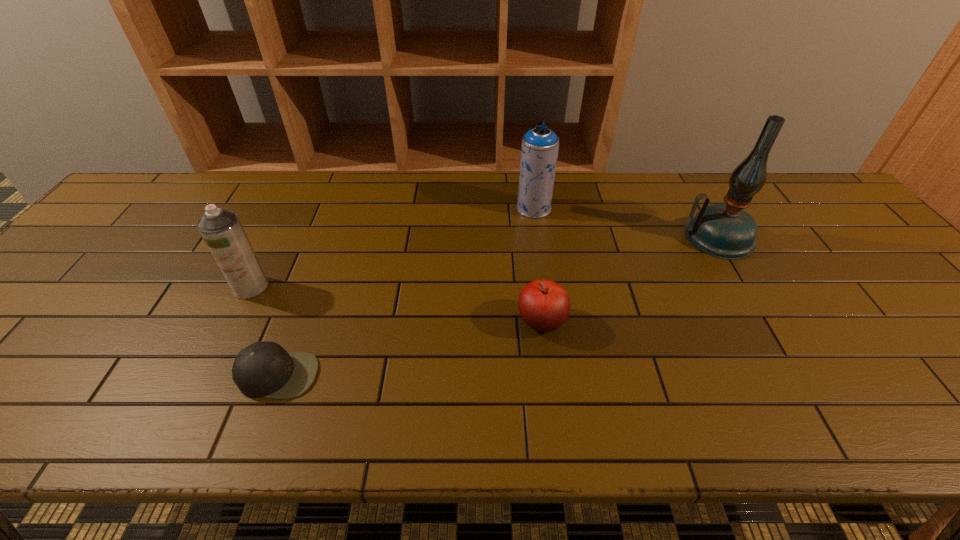
You are a GUI agent. You are given a task and a screenshot of the screen. Output one action in this format:
    pyautogui.click(x=<x>, y=<y>)
    Task: Click on the free point at the right edge
    
    Given the screenshot: What is the action you would take?
    pyautogui.click(x=851, y=278)

Find the location of a particular element. The height and width of the screenshot is (540, 960). vacant space at the far left corner is located at coordinates (161, 184).

I want to click on vacant space at the far right corner of the desktop, so click(x=822, y=192).

Where is `vacant area that lies between the oil lamp and the right aerosol can`? This screenshot has height=540, width=960. vacant area that lies between the oil lamp and the right aerosol can is located at coordinates (626, 223).

Locate an element on the screen. free area in between the second nearest object and the shortest object is located at coordinates (410, 348).

You are a GUI agent. You are given a task and a screenshot of the screen. Output one action in this format:
    pyautogui.click(x=<x>, y=<y>)
    Task: Click on the unoccupied area between the tallest object and the right aerosol can
    
    Given the screenshot: What is the action you would take?
    pyautogui.click(x=626, y=223)

Locate an element on the screen. This screenshot has width=960, height=540. empty space that is in between the farther aerosol can and the third farthest object is located at coordinates (393, 247).

This screenshot has height=540, width=960. What are the coordinates of `free spot between the apple and the oil lamp` in the screenshot? It's located at (629, 280).

Where is `vacant point located between the third nearest object and the fourth tallest object`? This screenshot has width=960, height=540. vacant point located between the third nearest object and the fourth tallest object is located at coordinates (396, 305).

You are a GUI agent. You are given a task and a screenshot of the screen. Output one action in this format:
    pyautogui.click(x=<x>, y=<y>)
    Task: Click on the vacant region between the fourth object from right to left and the nearer aerosol can
    Image resolution: width=960 pixels, height=540 pixels.
    Given the screenshot: What is the action you would take?
    coord(265,331)